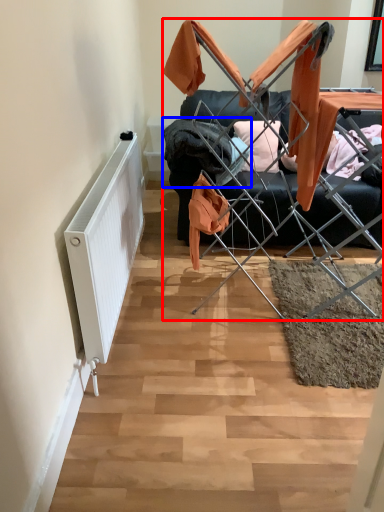
Question: Which of the following is the farthest to the observer, furniture (highlighted by a red box) or clothing (highlighted by a blue box)?

Choices:
 (A) furniture
 (B) clothing

Answer: (B)